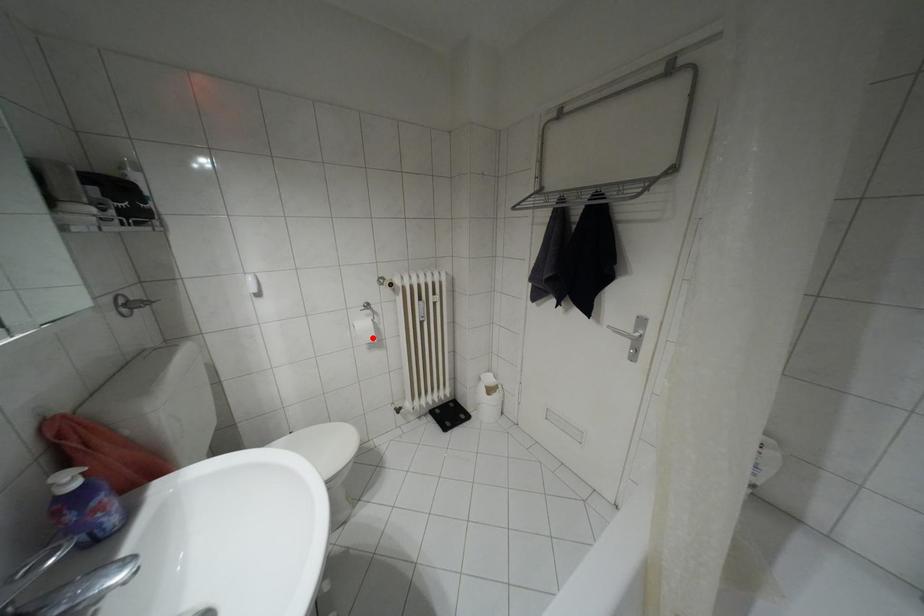
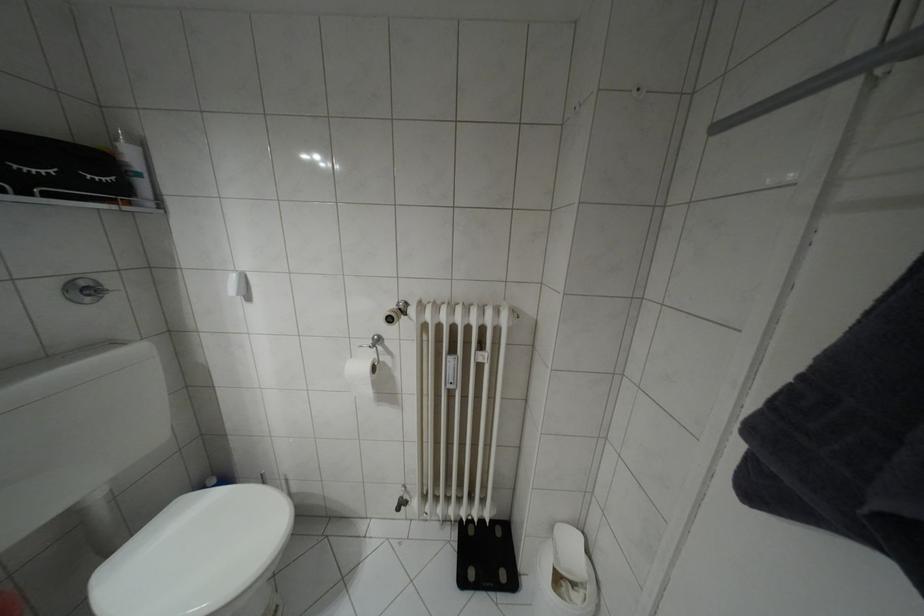
Question: I am providing you with two images of the same scene from different viewpoints. Given a red point in image1, look at the same physical point in image2. Is it:

Choices:
 (A) Closer to the viewpoint
 (B) Farther from the viewpoint

Answer: (B)